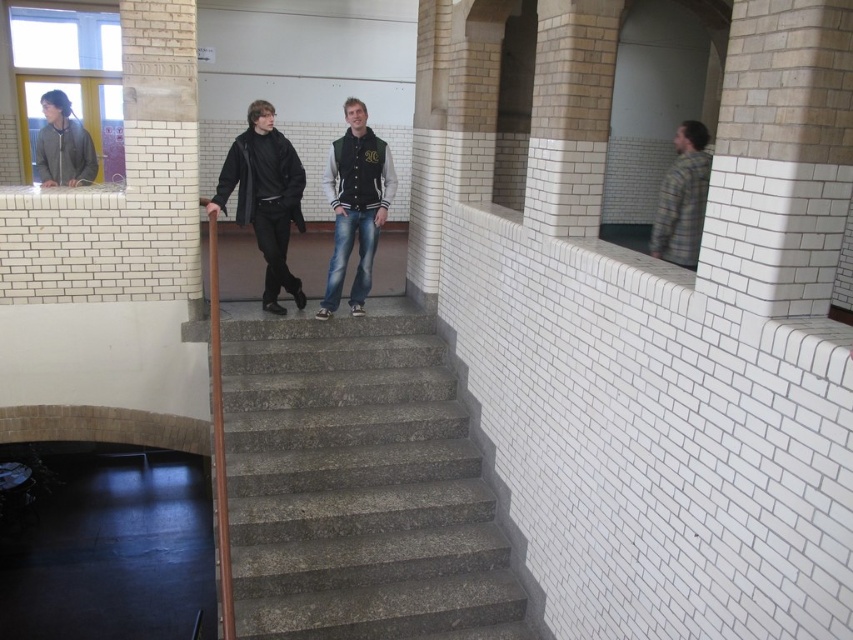
You are a delivery person holding a package that requires a 12 inch clearance to pass between two people. You need to walk through the space between the black matte jacket at center and the varsity jacket at center. Can you safely pass through this space with your package?

The distance between the black matte jacket at center and the varsity jacket at center is 6.25 inches, which is less than the required 12 inch clearance. Therefore, you cannot safely pass through this space with your package.

You are standing at the top of the staircase and want to greet the two people wearing the black matte jacket at center and the varsity jacket at center. Which one is closer to you?

The black matte jacket at center is closer to you since it is in front of the varsity jacket at center.

You are standing at the top of the staircase in this indoor setting. There are two points marked on the wall. One is at coordinates point (366, 269) and the other is at point (62, 140). Which point is closer to you?

Point (366, 269) is closer to the camera than point (62, 140), so the point at coordinates point (366, 269) is closer to you.